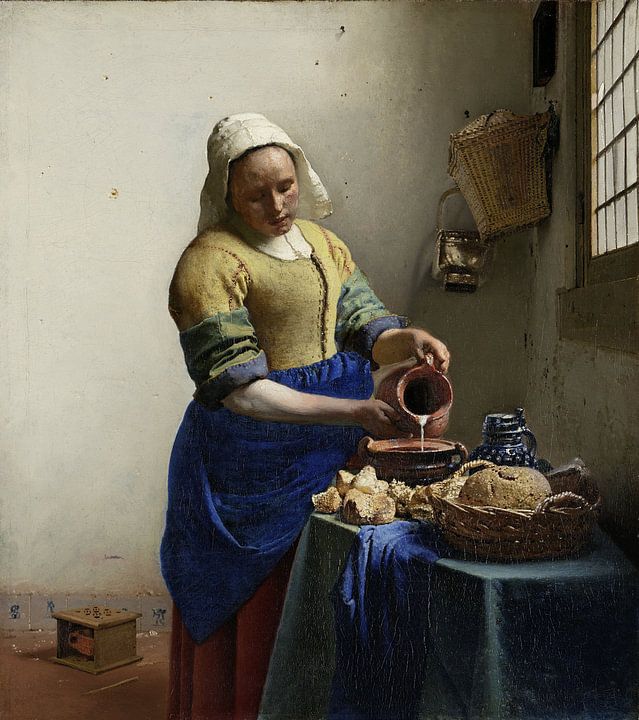
The width and height of the screenshot is (639, 720). In order to click on earthenware pitcher in this screenshot , I will do `click(443, 420)`.